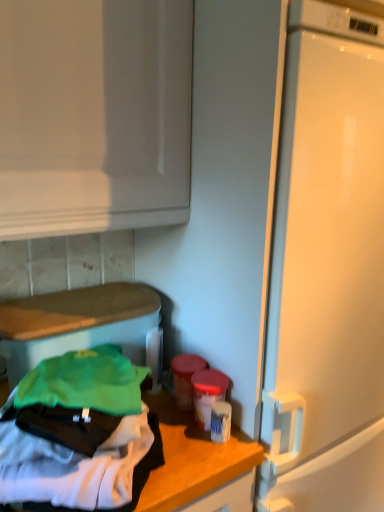
Question: From a real-world perspective, relative to white matte countertop at lower left, is matte green fabric at lower left vertically above or below?

Choices:
 (A) above
 (B) below

Answer: (A)

Question: Is matte green fabric at lower left to the left or to the right of white matte countertop at lower left in the image?

Choices:
 (A) left
 (B) right

Answer: (A)

Question: From the image's perspective, relative to white matte countertop at lower left, is matte green fabric at lower left above or below?

Choices:
 (A) above
 (B) below

Answer: (A)

Question: Is white matte countertop at lower left to the left or to the right of matte green fabric at lower left in the image?

Choices:
 (A) left
 (B) right

Answer: (B)

Question: Is white matte countertop at lower left spatially inside matte green fabric at lower left, or outside of it?

Choices:
 (A) inside
 (B) outside

Answer: (B)

Question: Considering the positions of white matte countertop at lower left and matte green fabric at lower left in the image, is white matte countertop at lower left taller or shorter than matte green fabric at lower left?

Choices:
 (A) tall
 (B) short

Answer: (B)

Question: Is point (243, 443) positioned closer to the camera than point (66, 329)?

Choices:
 (A) farther
 (B) closer

Answer: (B)